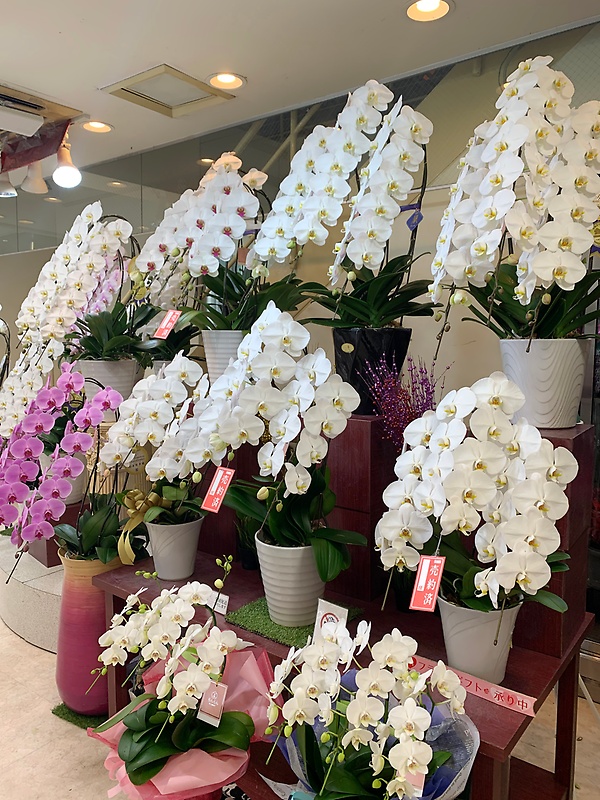
Find the location of `ledge`. ledge is located at coordinates (49, 584).